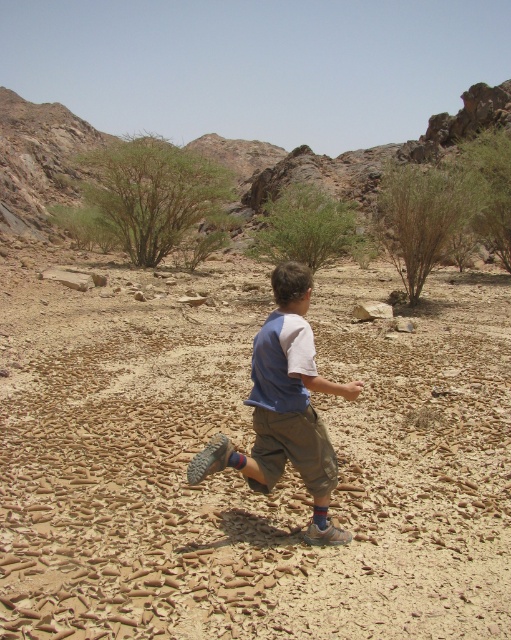
Question: Can you confirm if brown cracked sand at center is positioned to the left of blue cotton shirt at center?

Choices:
 (A) yes
 (B) no

Answer: (B)

Question: Which point is closer to the camera taking this photo?

Choices:
 (A) (108, 442)
 (B) (265, 371)

Answer: (B)

Question: Is brown cracked sand at center wider than blue cotton shirt at center?

Choices:
 (A) yes
 (B) no

Answer: (A)

Question: Which point appears farthest from the camera in this image?

Choices:
 (A) (86, 592)
 (B) (315, 529)

Answer: (B)

Question: Which point is closer to the camera taking this photo?

Choices:
 (A) (293, 308)
 (B) (196, 541)

Answer: (A)

Question: Can you confirm if brown cracked sand at center is thinner than blue cotton shirt at center?

Choices:
 (A) no
 (B) yes

Answer: (A)